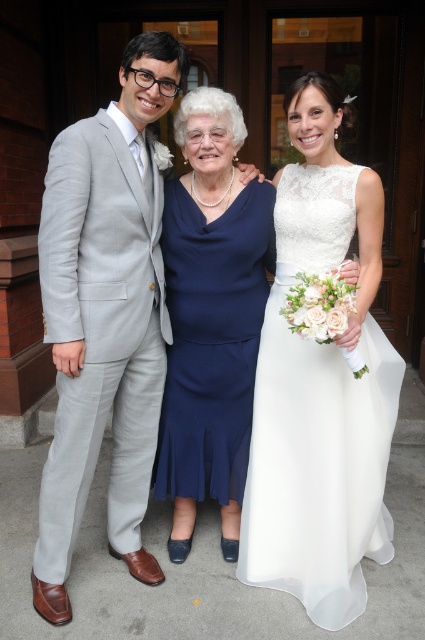
Question: From the image, what is the correct spatial relationship of light gray suit at left in relation to navy satin dress at center?

Choices:
 (A) below
 (B) above

Answer: (B)

Question: Among these points, which one is nearest to the camera?

Choices:
 (A) coord(384,392)
 (B) coord(229,385)
 (C) coord(64,593)

Answer: (C)

Question: Which point appears farthest from the camera in this image?

Choices:
 (A) pyautogui.click(x=303, y=497)
 (B) pyautogui.click(x=261, y=186)

Answer: (B)

Question: Does white lace dress at center appear under light gray suit at left?

Choices:
 (A) no
 (B) yes

Answer: (B)

Question: Among these points, which one is farthest from the camera?

Choices:
 (A) (142, 157)
 (B) (317, 557)
 (C) (172, 365)

Answer: (C)

Question: Can you confirm if white lace dress at center is positioned above navy satin dress at center?

Choices:
 (A) no
 (B) yes

Answer: (B)